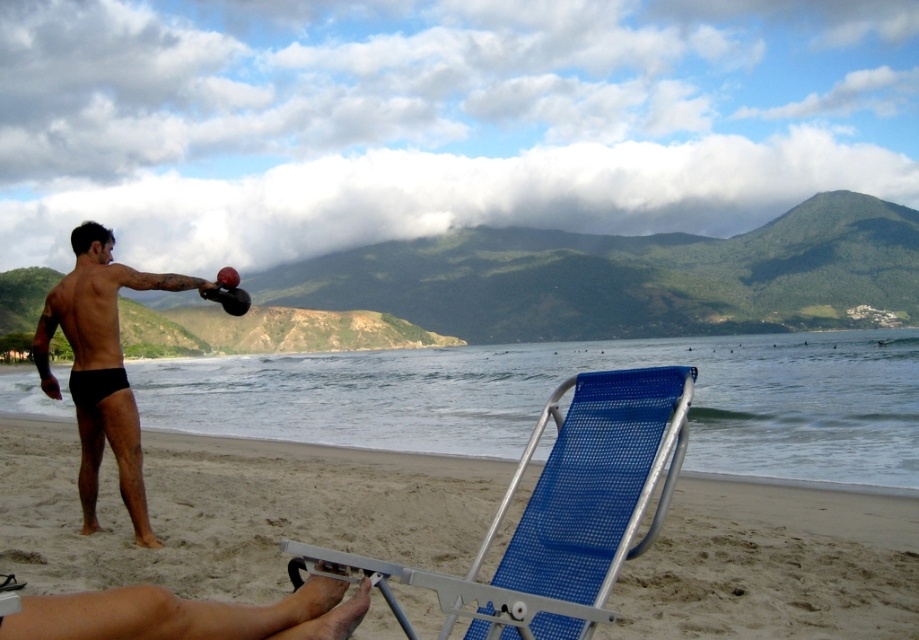
You are a photographer setting up a shoot on the beach. You want to position a model so they are seated on the blue mesh beach chair at lower center while ensuring their black matte shorts at left are visible in the frame. Based on their positions, is this possible?

The blue mesh beach chair at lower center is above the black matte shorts at left, so yes, the model can be seated on the blue mesh beach chair at lower center while still having their black matte shorts at left visible in the frame since the chair is positioned higher up.

You are a photographer trying to capture a candid shot of the man in black matte shorts at left and the blue mesh beach chair at lower center. To ensure both subjects are in frame, should you adjust your camera to a wider angle or a narrower angle?

The blue mesh beach chair at lower center is to the right of black matte shorts at left, so they are positioned apart from each other. To include both in the frame, you should use a wider angle.

You are a photographer planning to take a portrait of the man with the kettlebell. To ensure the blue mesh chair at lower center is not in the frame, where should you position yourself relative to the man?

The blue mesh chair at lower center is located at coordinates point (233, 509). To avoid including it in the portrait, position yourself in a direction away from the chair, ensuring the camera angle does not capture the area where the chair is placed.